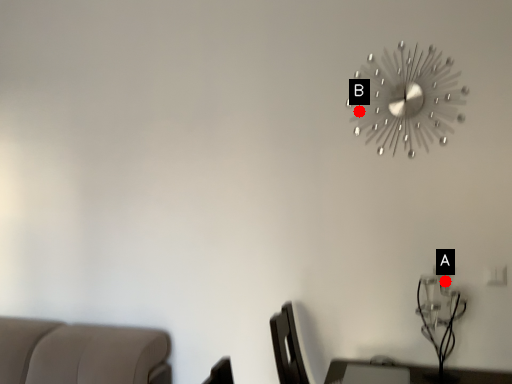
Question: Two points are circled on the image, labeled by A and B beside each circle. Among these points, which one is nearest to the camera?

Choices:
 (A) A is closer
 (B) B is closer

Answer: (A)